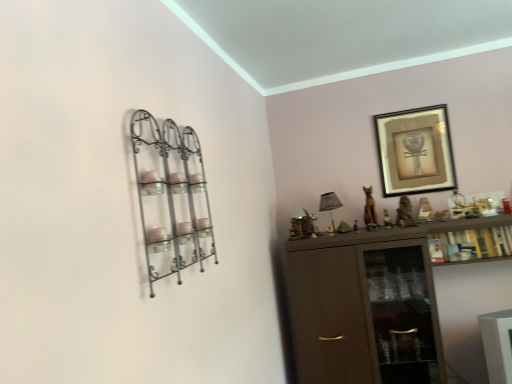
Looking at this image, measure the distance between point (x=449, y=260) and camera.

Point (x=449, y=260) and camera are 2.50 meters apart.

What do you see at coordinates (474, 238) in the screenshot? I see `wooden cabinet at right` at bounding box center [474, 238].

Find the location of a particular element. satin gray fabric lampshade at upper center is located at coordinates (329, 205).

Image resolution: width=512 pixels, height=384 pixels. In order to click on gold-framed artwork at upper right in this screenshot , I will do `click(415, 151)`.

The image size is (512, 384). I want to click on wooden cabinet at right, so click(x=474, y=238).

Relative to satin gray fabric lampshade at upper center, is gold-framed artwork at upper right in front or behind?

gold-framed artwork at upper right is positioned farther from the viewer than satin gray fabric lampshade at upper center.

Is gold-framed artwork at upper right placed right next to satin gray fabric lampshade at upper center?

No, gold-framed artwork at upper right is not next to satin gray fabric lampshade at upper center.

Is point (442, 188) farther from camera compared to point (333, 224)?

No, it is not.

From the image's perspective, is gold-framed artwork at upper right above or below satin gray fabric lampshade at upper center?

Based on their image positions, gold-framed artwork at upper right is located above satin gray fabric lampshade at upper center.

Is gold-framed artwork at upper right aimed at wooden cabinet at right?

No, gold-framed artwork at upper right is not turned towards wooden cabinet at right.

Where is `picture frame above the wooden cabinet at right (from a real-world perspective)`? Image resolution: width=512 pixels, height=384 pixels. picture frame above the wooden cabinet at right (from a real-world perspective) is located at coordinates (415, 151).

Measure the distance from gold-framed artwork at upper right to wooden cabinet at right.

A distance of 46.86 centimeters exists between gold-framed artwork at upper right and wooden cabinet at right.

From the image's perspective, is gold-framed artwork at upper right positioned above or below wooden cabinet at right?

gold-framed artwork at upper right is above wooden cabinet at right.

From a real-world perspective, is gold-framed artwork at upper right beneath metallic wire shelf at left?

No.

How far apart are gold-framed artwork at upper right and metallic wire shelf at left?

gold-framed artwork at upper right is 1.72 meters away from metallic wire shelf at left.

Choose the correct answer: Is gold-framed artwork at upper right inside metallic wire shelf at left or outside it?

gold-framed artwork at upper right exists outside the volume of metallic wire shelf at left.

From the picture: From the image's perspective, is gold-framed artwork at upper right above metallic wire shelf at left?

A: Yes, from the image's perspective, gold-framed artwork at upper right is on top of metallic wire shelf at left.

Looking at the image, does metallic wire shelf at left seem bigger or smaller compared to gold-framed artwork at upper right?

In the image, metallic wire shelf at left appears to be larger than gold-framed artwork at upper right.

Can you confirm if metallic wire shelf at left is thinner than gold-framed artwork at upper right?

In fact, metallic wire shelf at left might be wider than gold-framed artwork at upper right.

Can you confirm if metallic wire shelf at left is shorter than gold-framed artwork at upper right?

Yes, metallic wire shelf at left is shorter than gold-framed artwork at upper right.

Is point (192, 217) more distant than point (392, 153)?

No, it is not.

In terms of width, does metallic wire shelf at left look wider or thinner when compared to wooden cabinet at right?

Considering their sizes, metallic wire shelf at left looks slimmer than wooden cabinet at right.

Is wooden cabinet at right a part of metallic wire shelf at left?

No, wooden cabinet at right is not surrounded by metallic wire shelf at left.

Does metallic wire shelf at left appear on the left side of wooden cabinet at right?

Correct, you'll find metallic wire shelf at left to the left of wooden cabinet at right.

Are metallic wire shelf at left and wooden cabinet at right beside each other?

metallic wire shelf at left and wooden cabinet at right are clearly separated.

Between satin gray fabric lampshade at upper center and wooden cabinet at right, which one has larger width?

Wider between the two is wooden cabinet at right.

In terms of height, does satin gray fabric lampshade at upper center look taller or shorter compared to wooden cabinet at right?

satin gray fabric lampshade at upper center is taller than wooden cabinet at right.

Which object is more forward, satin gray fabric lampshade at upper center or wooden cabinet at right?

wooden cabinet at right.

Does satin gray fabric lampshade at upper center have a smaller size compared to wooden cabinet at right?

Yes.

In the scene shown: Which object is thinner, satin gray fabric lampshade at upper center or metallic wire shelf at left?

With smaller width is metallic wire shelf at left.

Can you tell me how much satin gray fabric lampshade at upper center and metallic wire shelf at left differ in facing direction?

satin gray fabric lampshade at upper center and metallic wire shelf at left are facing 89.6 degrees away from each other.

I want to click on lamp below the metallic wire shelf at left (from the image's perspective), so click(x=329, y=205).

Considering the sizes of objects satin gray fabric lampshade at upper center and metallic wire shelf at left in the image provided, who is smaller, satin gray fabric lampshade at upper center or metallic wire shelf at left?

satin gray fabric lampshade at upper center is smaller.

The height and width of the screenshot is (384, 512). I want to click on picture frame lying behind the satin gray fabric lampshade at upper center, so click(415, 151).

You are a GUI agent. You are given a task and a screenshot of the screen. Output one action in this format:
    pyautogui.click(x=<x>, y=<y>)
    Task: Click on the cabinet on the right of the gold-framed artwork at upper right
    This screenshot has width=512, height=384.
    Given the screenshot: What is the action you would take?
    pyautogui.click(x=474, y=238)

Considering their positions, is gold-framed artwork at upper right positioned closer to wooden cabinet at right than satin gray fabric lampshade at upper center?

gold-framed artwork at upper right is closer to wooden cabinet at right.

Estimate the real-world distances between objects in this image. Which object is further from wooden cabinet at right, metallic wire shelf at left or gold-framed artwork at upper right?

metallic wire shelf at left lies further to wooden cabinet at right than the other object.

When comparing their distances from satin gray fabric lampshade at upper center, does gold-framed artwork at upper right or metallic wire shelf at left seem further?

metallic wire shelf at left lies further to satin gray fabric lampshade at upper center than the other object.

Looking at this image, based on their spatial positions, is satin gray fabric lampshade at upper center or gold-framed artwork at upper right closer to metallic wire shelf at left?

satin gray fabric lampshade at upper center is closer to metallic wire shelf at left.

Considering their positions, is wooden cabinet at right positioned further to metallic wire shelf at left than gold-framed artwork at upper right?

gold-framed artwork at upper right is further to metallic wire shelf at left.

Which object lies further to the anchor point gold-framed artwork at upper right, wooden cabinet at right or satin gray fabric lampshade at upper center?

satin gray fabric lampshade at upper center is positioned further to the anchor gold-framed artwork at upper right.

Looking at the image, which one is located closer to metallic wire shelf at left, wooden cabinet at right or satin gray fabric lampshade at upper center?

Based on the image, satin gray fabric lampshade at upper center appears to be nearer to metallic wire shelf at left.

Looking at the image, which one is located closer to metallic wire shelf at left, gold-framed artwork at upper right or wooden cabinet at right?

Among the two, wooden cabinet at right is located nearer to metallic wire shelf at left.

Where is `picture frame between satin gray fabric lampshade at upper center and wooden cabinet at right`? The width and height of the screenshot is (512, 384). picture frame between satin gray fabric lampshade at upper center and wooden cabinet at right is located at coordinates (415, 151).

I want to click on cabinet between metallic wire shelf at left and gold-framed artwork at upper right from front to back, so click(474, 238).

Identify the location of cabinet between metallic wire shelf at left and satin gray fabric lampshade at upper center along the z-axis. This screenshot has height=384, width=512. (474, 238).

The width and height of the screenshot is (512, 384). In order to click on lamp between metallic wire shelf at left and gold-framed artwork at upper right in the front-back direction in this screenshot , I will do `click(329, 205)`.